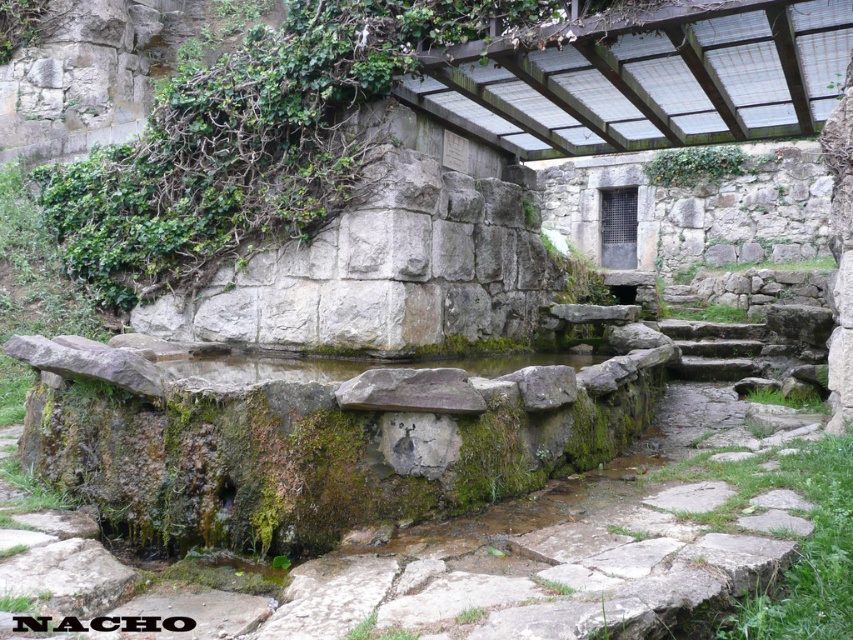
Question: Does gray rough stone wall at upper left appear under green mossy vines at upper center?

Choices:
 (A) no
 (B) yes

Answer: (B)

Question: Does gray rough stone wall at upper left have a lesser width compared to green mossy vines at upper center?

Choices:
 (A) no
 (B) yes

Answer: (A)

Question: Among these points, which one is nearest to the camera?

Choices:
 (A) (381, 275)
 (B) (666, 156)

Answer: (A)

Question: Considering the real-world distances, which object is closest to the gray rough stone wall at upper left?

Choices:
 (A) green mossy vines at upper center
 (B) clear stone water at center

Answer: (B)

Question: Is gray rough stone wall at upper left below clear stone water at center?

Choices:
 (A) no
 (B) yes

Answer: (A)

Question: Which object is closer to the camera taking this photo?

Choices:
 (A) gray rough stone wall at upper left
 (B) green mossy vines at upper center
 (C) clear stone water at center

Answer: (C)